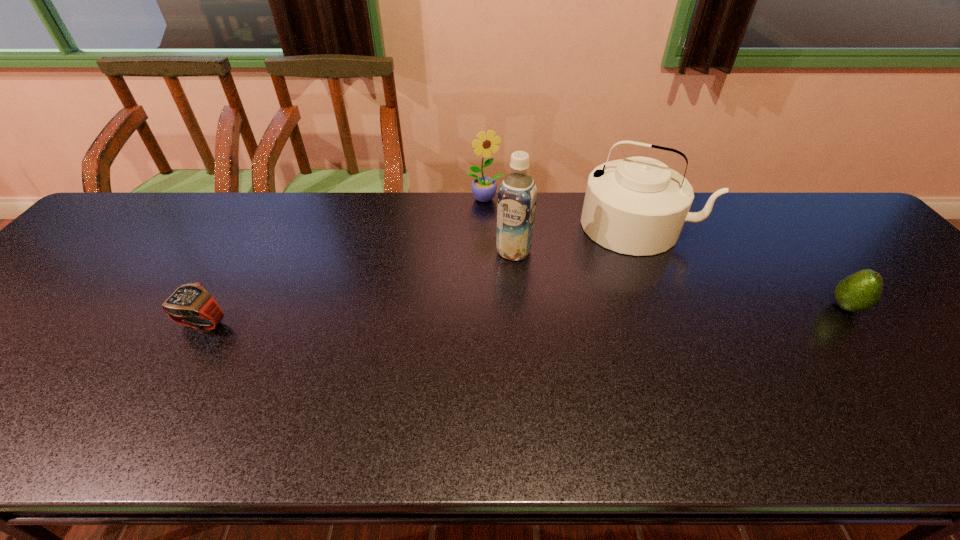
The image size is (960, 540). In order to click on free space located on the front-facing side of the sunflower in this screenshot , I will do (496, 219).

I want to click on free space located 0.150m on the front-facing side of the sunflower, so click(x=504, y=235).

Identify the location of vacant space located on the label of the soya milk. (448, 369).

What are the coordinates of `free space located on the label of the soya milk` in the screenshot? It's located at (442, 381).

Find the location of `vacant space positioned on the label of the soya milk`. vacant space positioned on the label of the soya milk is located at coordinates (446, 373).

Find the location of a particular element. The image size is (960, 540). free region located 0.400m on the spout of the second object from right to left is located at coordinates (591, 366).

This screenshot has width=960, height=540. Find the location of `free space located on the spout of the second object from right to left`. free space located on the spout of the second object from right to left is located at coordinates (621, 267).

This screenshot has width=960, height=540. I want to click on vacant region located on the spout of the second object from right to left, so click(x=610, y=306).

Locate an element on the screen. This screenshot has width=960, height=540. sunflower that is positioned at the far edge is located at coordinates (484, 188).

You are a GUI agent. You are given a task and a screenshot of the screen. Output one action in this format:
    pyautogui.click(x=<x>, y=<y>)
    Task: Click on the soya milk positioned at the far edge
    This screenshot has width=960, height=540.
    Given the screenshot: What is the action you would take?
    pyautogui.click(x=517, y=195)